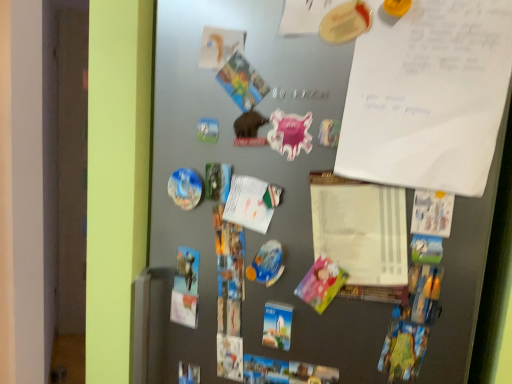
Question: Is white paper at upper right facing towards metallic gray fridge at center?

Choices:
 (A) no
 (B) yes

Answer: (B)

Question: Is white paper at upper right positioned behind metallic gray fridge at center?

Choices:
 (A) no
 (B) yes

Answer: (B)

Question: Is white paper at upper right far away from metallic gray fridge at center?

Choices:
 (A) yes
 (B) no

Answer: (B)

Question: Does white paper at upper right have a lesser width compared to metallic gray fridge at center?

Choices:
 (A) yes
 (B) no

Answer: (A)

Question: Is metallic gray fridge at center inside white paper at upper right?

Choices:
 (A) no
 (B) yes

Answer: (A)

Question: Is white paper at upper right with metallic gray fridge at center?

Choices:
 (A) no
 (B) yes

Answer: (A)

Question: Would you consider pink glossy magnet at center, placed as the 1th art when sorted from right to left, to be distant from pink paper postcard at center-right?

Choices:
 (A) yes
 (B) no

Answer: (B)

Question: From a real-world perspective, is pink glossy magnet at center, marked as the 1th art in a top-to-bottom arrangement, located beneath pink paper postcard at center-right?

Choices:
 (A) yes
 (B) no

Answer: (B)

Question: Is pink glossy magnet at center, marked as the 1th art in a top-to-bottom arrangement, positioned before pink paper postcard at center-right?

Choices:
 (A) yes
 (B) no

Answer: (B)

Question: Does pink glossy magnet at center, which is counted as the second art, starting from the bottom, appear on the right side of pink paper postcard at center-right?

Choices:
 (A) no
 (B) yes

Answer: (A)

Question: Is the position of pink glossy magnet at center, which is counted as the 1th art, starting from the front, more distant than that of pink paper postcard at center-right?

Choices:
 (A) no
 (B) yes

Answer: (B)

Question: Is pink glossy magnet at center, which is counted as the second art, starting from the bottom, shorter than pink paper postcard at center-right?

Choices:
 (A) no
 (B) yes

Answer: (B)

Question: Are glossy plastic magnet at center-left, which is the first art from left to right, and metallic gray fridge at center making contact?

Choices:
 (A) no
 (B) yes

Answer: (A)